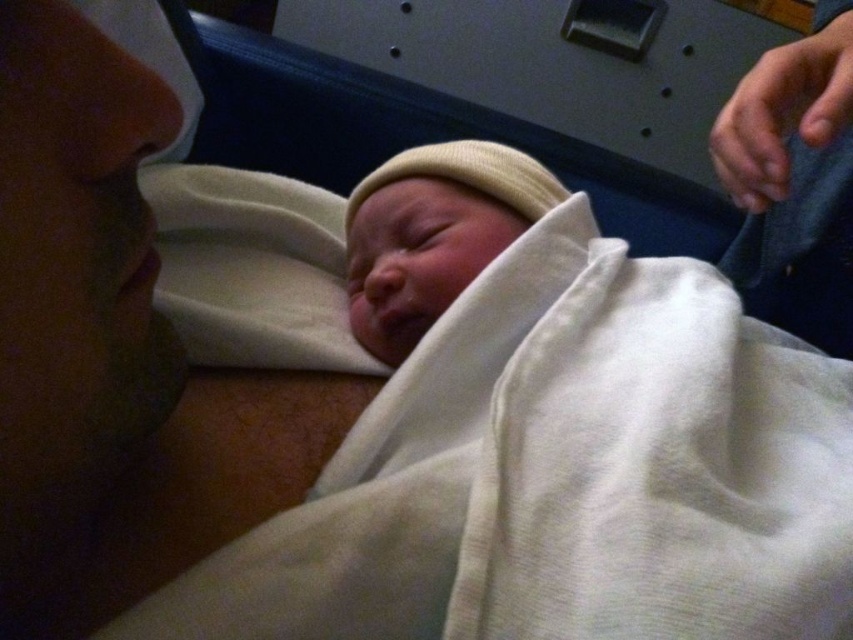
You are a nurse checking the baby in the hospital. You need to place a small medical device on the baby. The device must be placed on either the smooth skin face at left or the white knit cap at center. According to the scene description, which location is suitable for placing the device?

The smooth skin face at left is suitable for placing the device because it is exposed skin, whereas the white knit cap at center is covered by fabric.

Consider the image. You are a nurse observing a newborn baby in the hospital. You notice the smooth skin face at left and the white knit cap at center. Which object occupies more space in the image?

The smooth skin face at left is larger in size than the white knit cap at center, so it occupies more space in the image.

You are a nurse in a hospital room. You need to place a small medical device on either the point at [189,483] or the point at [384,250]. Which point is closer to you?

The point at [189,483] is closer to the viewer than the point at [384,250], so you should place the device there.